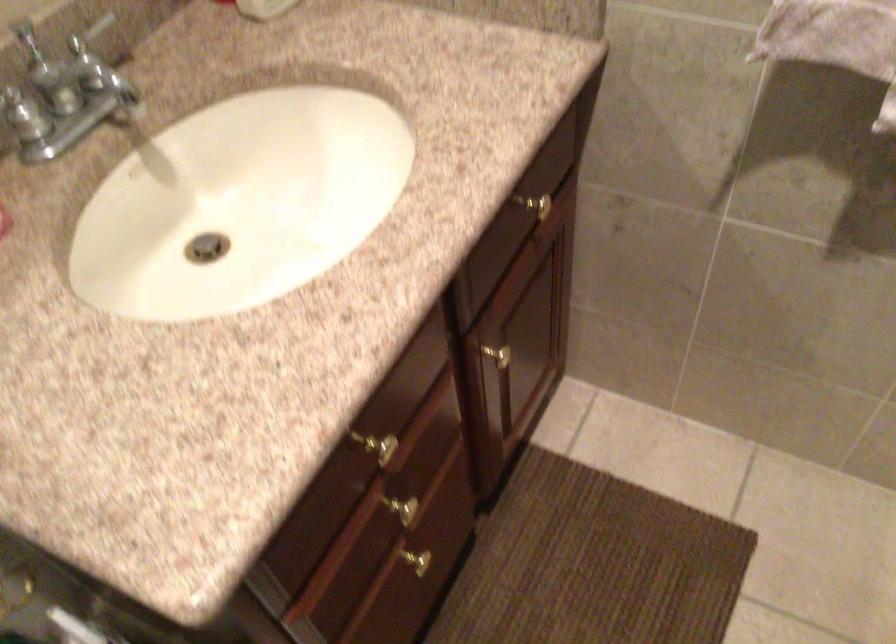
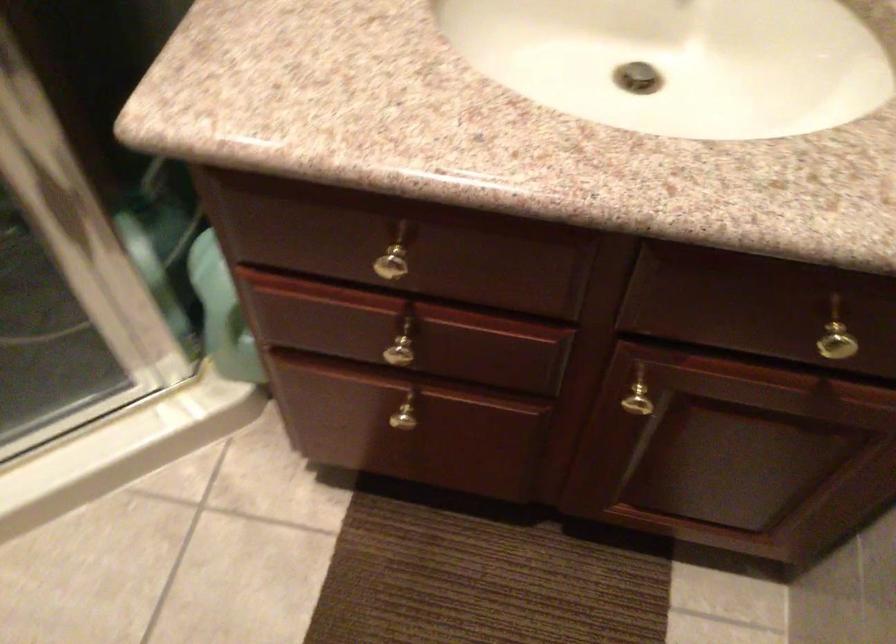
Locate, in the second image, the point that corresponds to the point at 409,512 in the first image.

(401, 354)